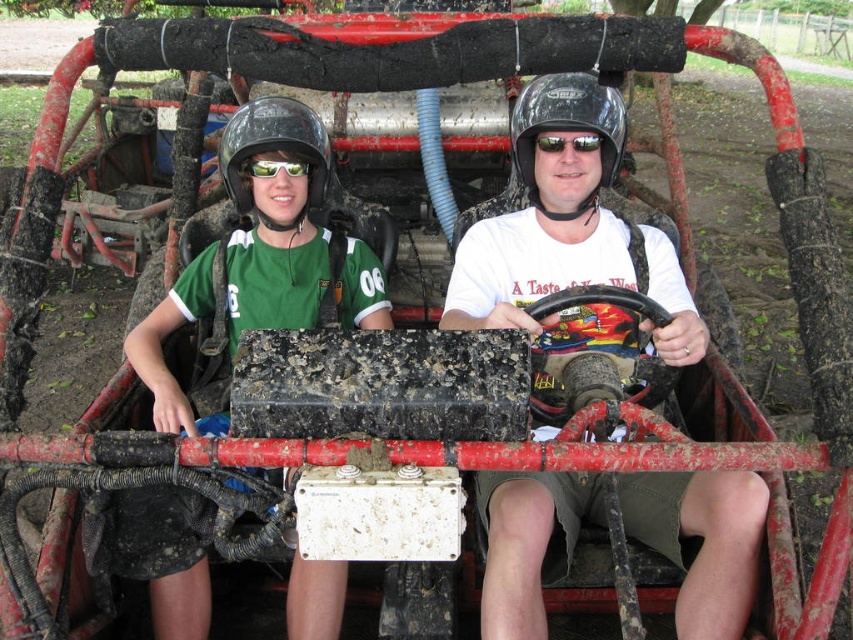
You are a safety inspector examining the seating arrangement of the red go kart. You notice the black matte helmet at center and the green matte sunglasses at center. Which object is placed above the other?

The black matte helmet at center is positioned over the green matte sunglasses at center.

You are a safety inspector checking the equipment of the go kart drivers. You notice the black matte helmet at center and the green matte sunglasses at center. Which one has a larger size?

The black matte helmet at center has a larger size compared to the green matte sunglasses at center.